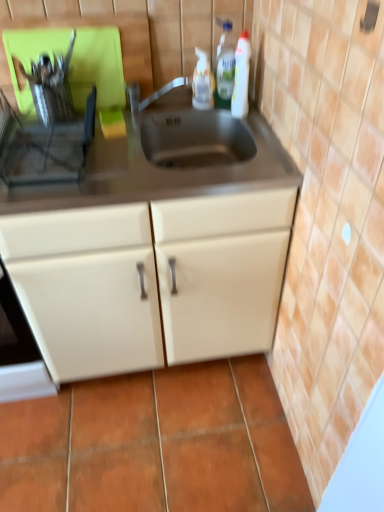
The image size is (384, 512). Find the location of `free region on the left part of satin nickel faucet at center`. free region on the left part of satin nickel faucet at center is located at coordinates (119, 128).